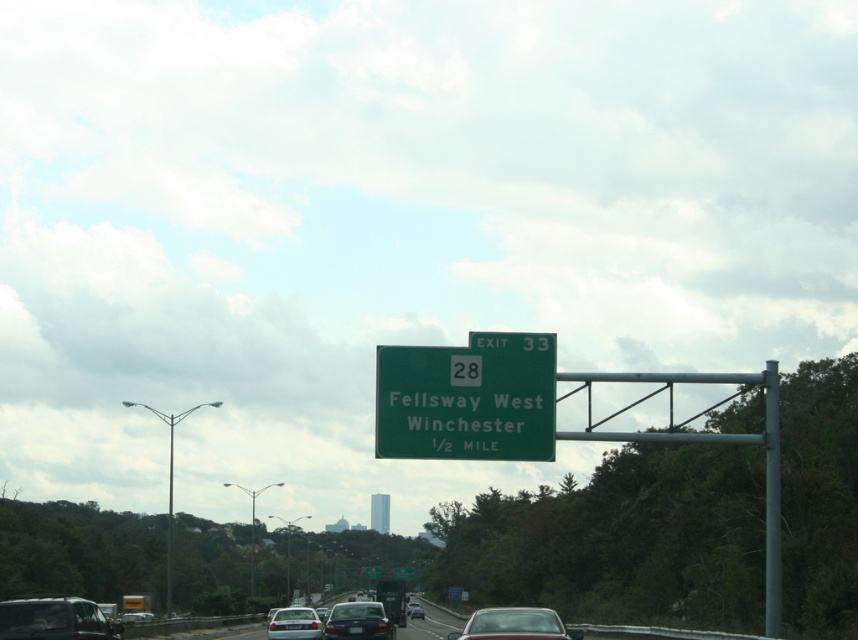
Is green matte sign at center wider than green metallic sign at upper center?

In fact, green matte sign at center might be narrower than green metallic sign at upper center.

Does point (463, 406) lie in front of point (366, 570)?

Yes, it is.

Is point (518, 419) less distant than point (376, 577)?

Yes, it is in front of point (376, 577).

The width and height of the screenshot is (858, 640). I want to click on green matte sign at center, so click(x=467, y=397).

Is point (367, 632) farther from camera compared to point (378, 570)?

No, it is not.

What are the coordinates of `matte black sedan at center` in the screenshot? It's located at (358, 621).

Which is below, matte silver sedan at center or silver metallic sedan at center?

silver metallic sedan at center is below.

The image size is (858, 640). Describe the element at coordinates (514, 625) in the screenshot. I see `matte silver sedan at center` at that location.

The image size is (858, 640). What do you see at coordinates (514, 625) in the screenshot?
I see `matte silver sedan at center` at bounding box center [514, 625].

Identify the location of matte silver sedan at center. This screenshot has height=640, width=858. (514, 625).